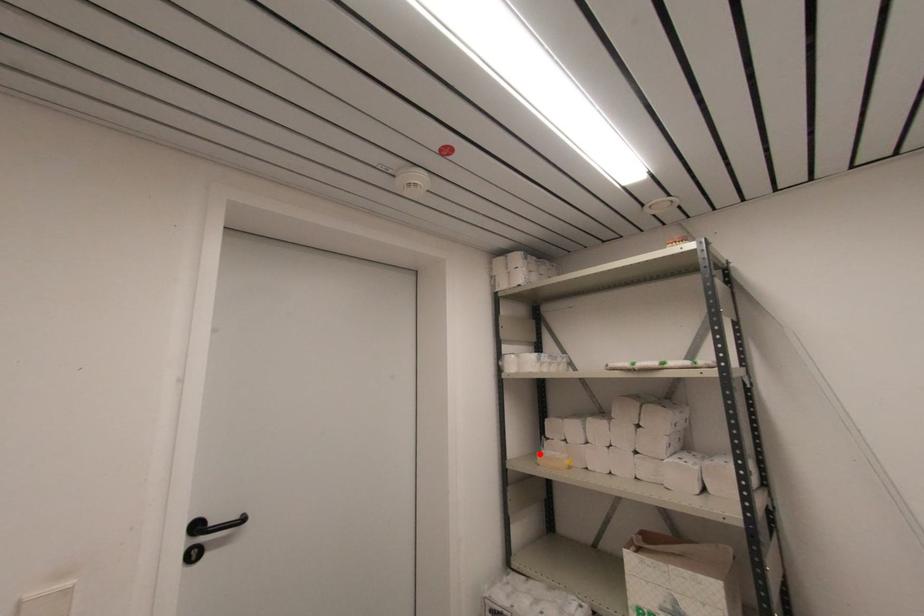
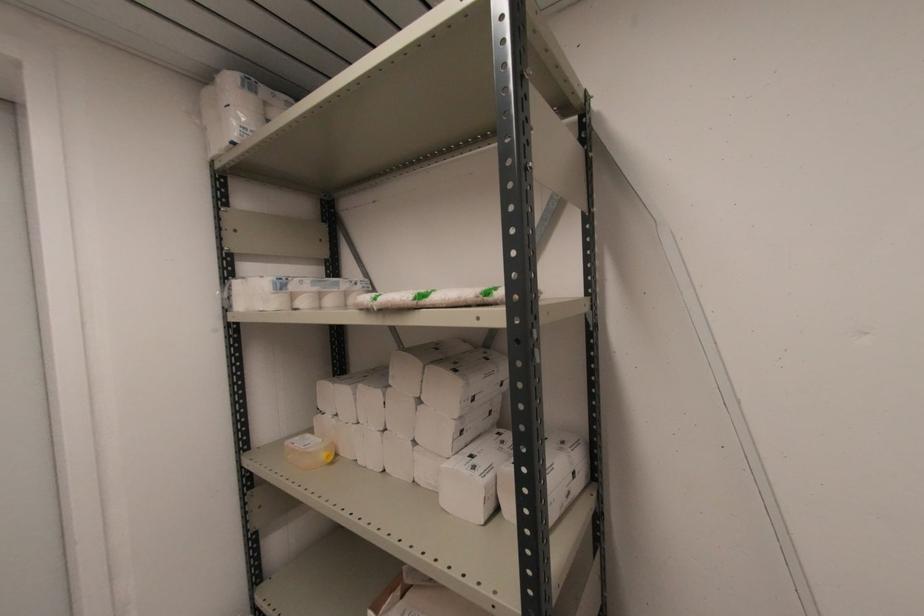
In the second image, find the point that corresponds to the highlighted location in the first image.

(289, 442)